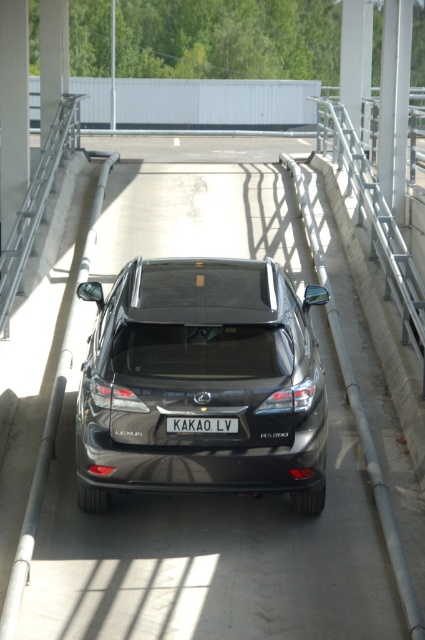
Question: Can you confirm if satin black suv at center is thinner than white plastic license plate at center?

Choices:
 (A) yes
 (B) no

Answer: (B)

Question: Is satin black suv at center bigger than white plastic license plate at center?

Choices:
 (A) yes
 (B) no

Answer: (A)

Question: Which object appears farthest from the camera in this image?

Choices:
 (A) satin black suv at center
 (B) white plastic license plate at center

Answer: (B)

Question: Considering the relative positions of satin black suv at center and white plastic license plate at center in the image provided, where is satin black suv at center located with respect to white plastic license plate at center?

Choices:
 (A) right
 (B) left

Answer: (A)